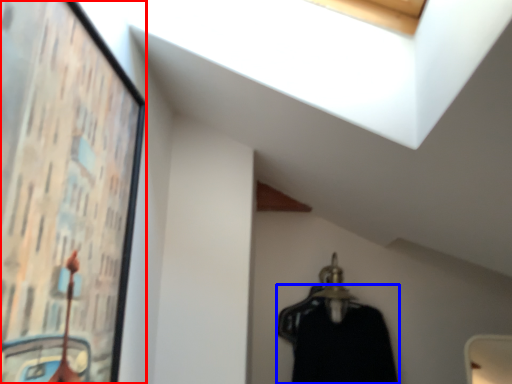
Question: Which object appears closest to the camera in this image, picture frame (highlighted by a red box) or clothing (highlighted by a blue box)?

Choices:
 (A) picture frame
 (B) clothing

Answer: (A)